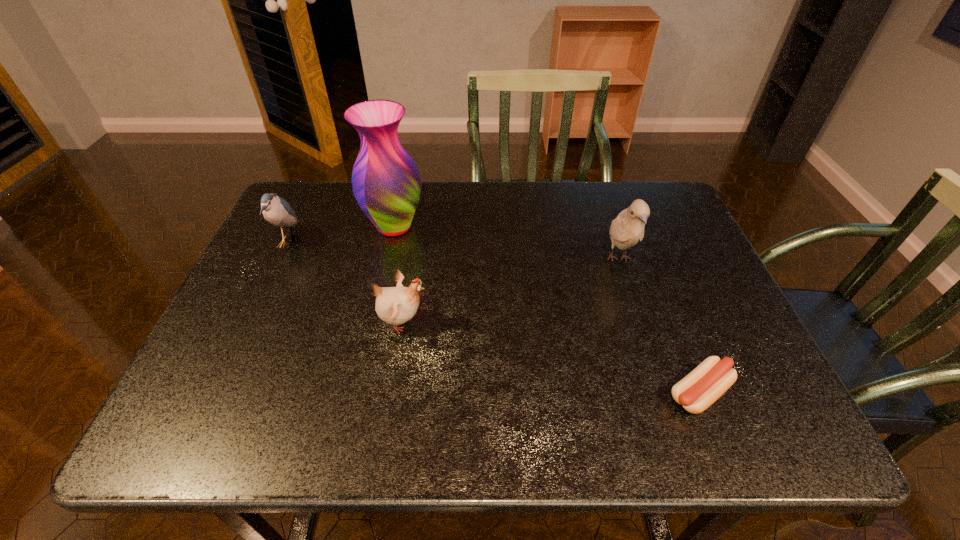
Select which bird is the third closest to the nearest object. Please provide its 2D coordinates. Your answer should be formatted as a tuple, i.e. [(x, y)], where the tuple contains the x and y coordinates of a point satisfying the conditions above.

[(277, 211)]

Identify the location of vacant space that satisfies the following two spatial constraints: 1. at the beak of the tallest bird; 2. on the right side of the nearest object. The width and height of the screenshot is (960, 540). (662, 393).

Find the location of a particular element. The height and width of the screenshot is (540, 960). free point that satisfies the following two spatial constraints: 1. at the tip of the nearest object's beak; 2. on the left side of the leftmost object is located at coordinates (216, 393).

Locate an element on the screen. free space that satisfies the following two spatial constraints: 1. at the tip of the leftmost object's beak; 2. on the right side of the shortest object is located at coordinates (216, 393).